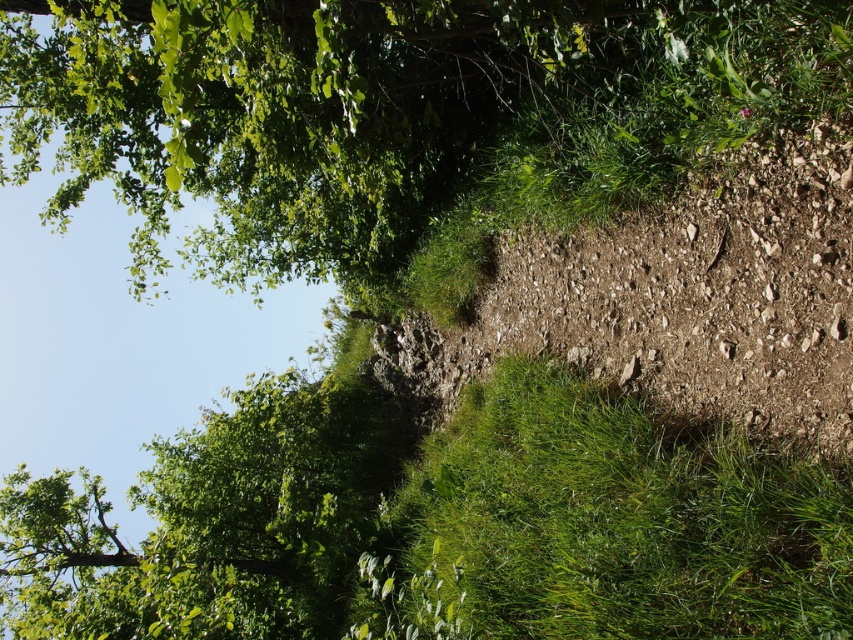
Can you confirm if green leafy tree at upper left is positioned to the right of green grass at lower right?

In fact, green leafy tree at upper left is to the left of green grass at lower right.

Who is shorter, green leafy tree at upper left or green grass at lower right?

With less height is green leafy tree at upper left.

Find the location of a particular element. Image resolution: width=853 pixels, height=640 pixels. green leafy tree at upper left is located at coordinates [384, 109].

Image resolution: width=853 pixels, height=640 pixels. Identify the location of green leafy tree at upper left. (384, 109).